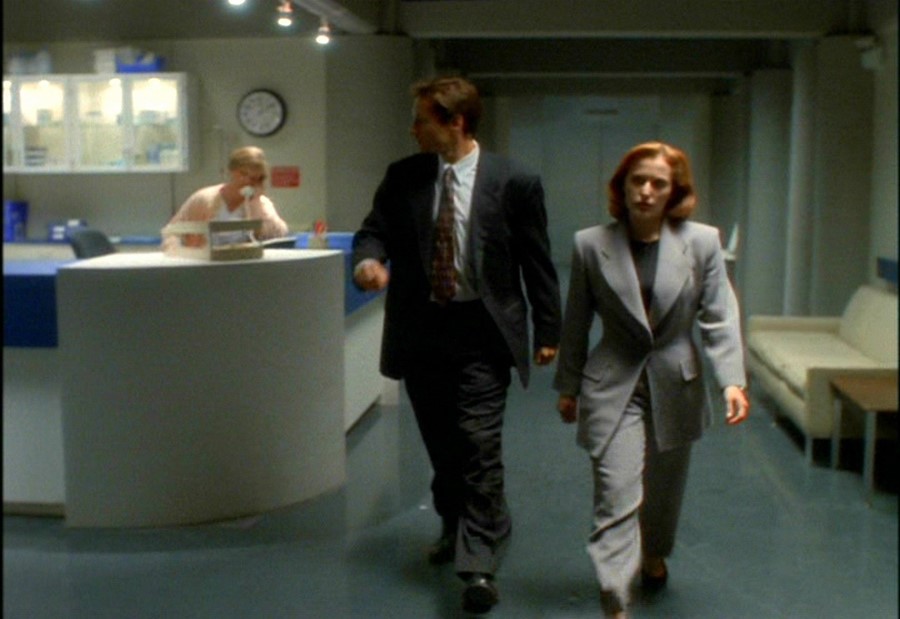
Find the location of `gray walls`. gray walls is located at coordinates (343, 113), (828, 178).